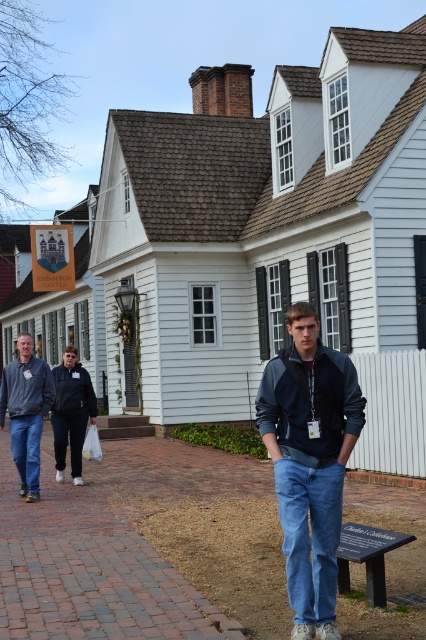
Between point (340, 381) and point (20, 372), which one is positioned in front?

Point (340, 381)

Does denim jacket at center appear on the left side of gray fleece jacket at left?

In fact, denim jacket at center is to the right of gray fleece jacket at left.

Which is in front, point (275, 460) or point (17, 417)?

Positioned in front is point (275, 460).

Identify the location of denim jacket at center. [x=310, y=461].

Is brick pavement at center bigger than gray fleece jacket at left?

Yes.

The width and height of the screenshot is (426, 640). Describe the element at coordinates (143, 547) in the screenshot. I see `brick pavement at center` at that location.

The width and height of the screenshot is (426, 640). Identify the location of brick pavement at center. (143, 547).

Can you confirm if brick pavement at center is positioned below denim jacket at center?

Indeed, brick pavement at center is positioned under denim jacket at center.

Which is more to the left, brick pavement at center or denim jacket at center?

brick pavement at center is more to the left.

Image resolution: width=426 pixels, height=640 pixels. I want to click on brick pavement at center, so click(x=143, y=547).